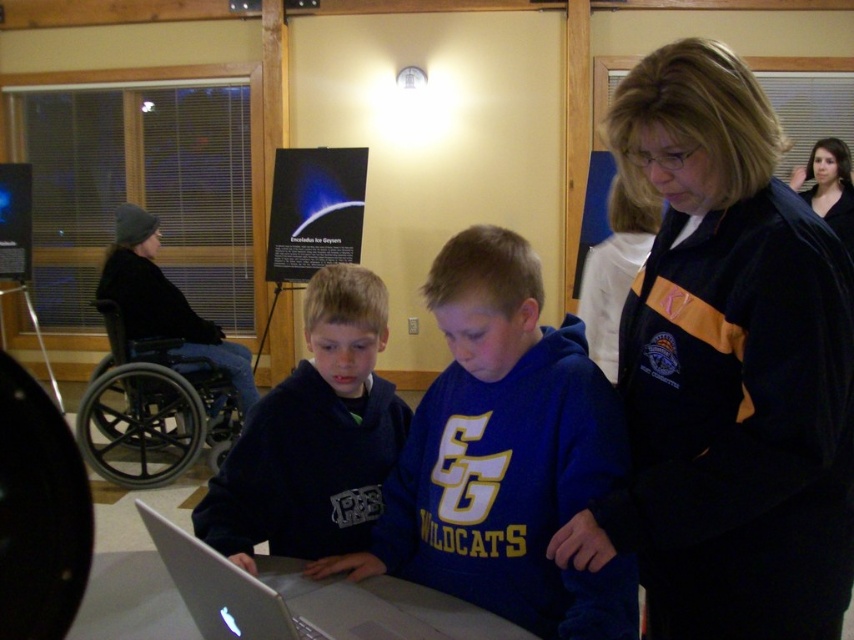
You are a photographer trying to capture a clear shot of the black fleece jacket at left without the blue fleece sweatshirt at center blocking it. What should you do?

The blue fleece sweatshirt at center is in front of the black fleece jacket at left, so you should move your camera position to the side to avoid the obstruction caused by the blue fleece sweatshirt at center.